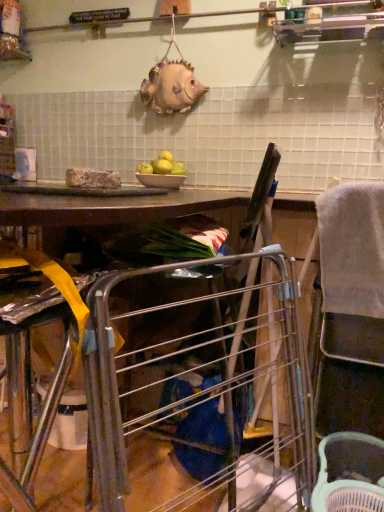
Question: Should I look upward or downward to see white plastic basket at lower right?

Choices:
 (A) up
 (B) down

Answer: (B)

Question: From a real-world perspective, is gray fabric feeding chair at right located higher than green matte apples at center?

Choices:
 (A) no
 (B) yes

Answer: (A)

Question: Is gray fabric feeding chair at right outside of green matte apples at center?

Choices:
 (A) yes
 (B) no

Answer: (A)

Question: Is gray fabric feeding chair at right facing towards green matte apples at center?

Choices:
 (A) yes
 (B) no

Answer: (B)

Question: Is gray fabric feeding chair at right facing away from green matte apples at center?

Choices:
 (A) yes
 (B) no

Answer: (B)

Question: Is gray fabric feeding chair at right touching green matte apples at center?

Choices:
 (A) yes
 (B) no

Answer: (B)

Question: From the image's perspective, would you say gray fabric feeding chair at right is shown under green matte apples at center?

Choices:
 (A) no
 (B) yes

Answer: (B)

Question: From a real-world perspective, is white glossy bowl at center positioned over green matte apples at center based on gravity?

Choices:
 (A) no
 (B) yes

Answer: (A)

Question: Is white glossy bowl at center at the left side of green matte apples at center?

Choices:
 (A) no
 (B) yes

Answer: (A)

Question: Is white glossy bowl at center smaller than green matte apples at center?

Choices:
 (A) yes
 (B) no

Answer: (A)

Question: Does white glossy bowl at center have a lesser width compared to green matte apples at center?

Choices:
 (A) yes
 (B) no

Answer: (B)

Question: Is white glossy bowl at center far from green matte apples at center?

Choices:
 (A) no
 (B) yes

Answer: (A)

Question: Is white glossy bowl at center taller than green matte apples at center?

Choices:
 (A) yes
 (B) no

Answer: (B)

Question: Is there a large distance between white plastic basket at lower right and gray fabric feeding chair at right?

Choices:
 (A) no
 (B) yes

Answer: (A)